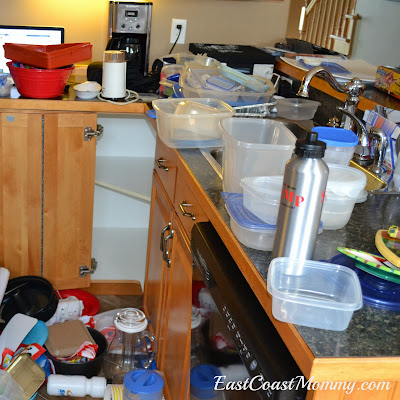
Identify the location of bottle. (282, 215).